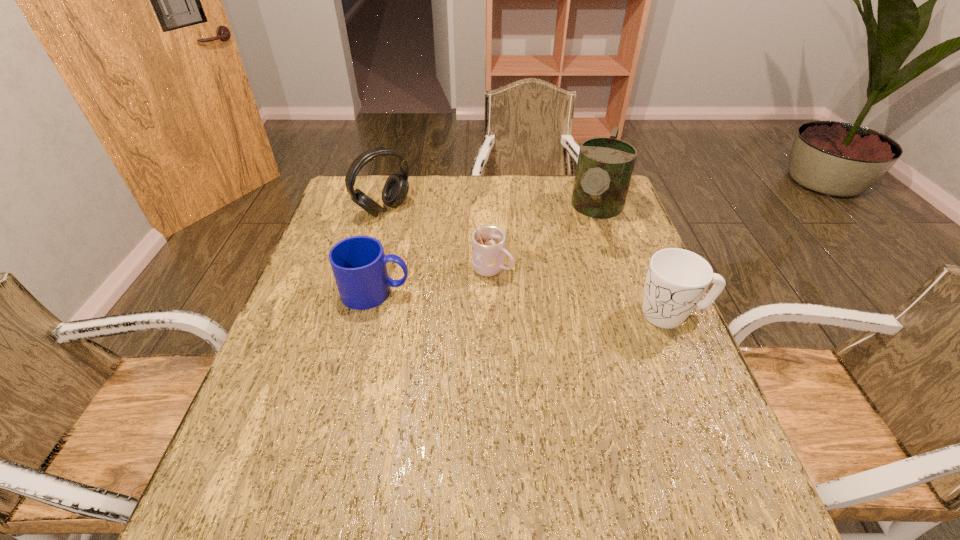
Find the location of a particular element. vacant space that's between the right mug and the cup is located at coordinates (582, 292).

Locate an element on the screen. The width and height of the screenshot is (960, 540). free space that is in between the watering can and the right mug is located at coordinates (634, 263).

Image resolution: width=960 pixels, height=540 pixels. Identify the location of free area in between the cup and the right mug. (582, 292).

Locate an element on the screen. free space that is in between the third object from left to right and the watering can is located at coordinates (543, 241).

This screenshot has width=960, height=540. Identify the location of blank region between the headset and the right mug. (528, 262).

This screenshot has width=960, height=540. What are the coordinates of `free point between the cup and the headset` in the screenshot? It's located at (438, 240).

Find the location of a particular element. The width and height of the screenshot is (960, 540). free area in between the watering can and the cup is located at coordinates (543, 241).

You are a GUI agent. You are given a task and a screenshot of the screen. Output one action in this format:
    pyautogui.click(x=<x>, y=<y>)
    Task: Click on the second closest object to the third object from left to right
    The image size is (960, 540).
    Given the screenshot: What is the action you would take?
    pyautogui.click(x=605, y=165)

I want to click on object identified as the fourth closest to the right mug, so click(395, 190).

Find the location of `free spot that satisfies the following two spatial constraints: 1. on the front side of the right mug; 2. on the side of the watering can with the handle`. free spot that satisfies the following two spatial constraints: 1. on the front side of the right mug; 2. on the side of the watering can with the handle is located at coordinates (628, 314).